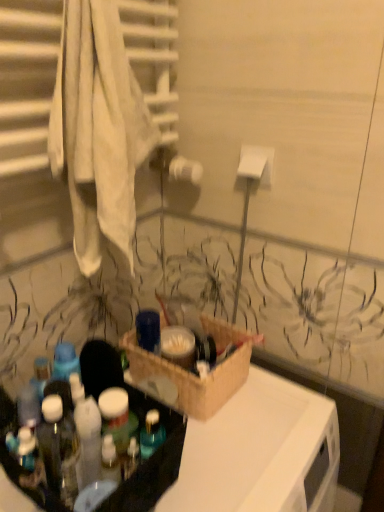
Question: Do you think woven basket at center is within translucent plastic bottles at lower left, or outside of it?

Choices:
 (A) outside
 (B) inside

Answer: (A)

Question: From a real-world perspective, is woven basket at center above or below translucent plastic bottles at lower left?

Choices:
 (A) above
 (B) below

Answer: (B)

Question: In the image, is woven basket at center positioned in front of or behind translucent plastic bottles at lower left?

Choices:
 (A) front
 (B) behind

Answer: (B)

Question: From a real-world perspective, is translucent plastic bottles at lower left physically located above or below woven basket at center?

Choices:
 (A) above
 (B) below

Answer: (A)

Question: Looking at their shapes, would you say translucent plastic bottles at lower left is wider or thinner than woven basket at center?

Choices:
 (A) wide
 (B) thin

Answer: (B)

Question: Considering their positions, is translucent plastic bottles at lower left located in front of or behind woven basket at center?

Choices:
 (A) behind
 (B) front

Answer: (B)

Question: Is translucent plastic bottles at lower left taller or shorter than woven basket at center?

Choices:
 (A) tall
 (B) short

Answer: (A)